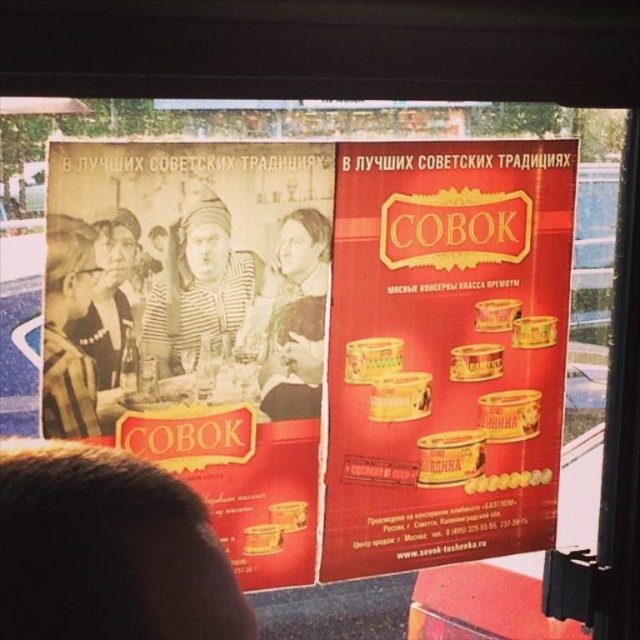
Question: Which point is farther to the camera?

Choices:
 (A) sepia paper poster at center
 (B) matte black headscarf at upper left

Answer: (B)

Question: Does matte black headscarf at upper left appear on the left side of matte black jacket at center?

Choices:
 (A) no
 (B) yes

Answer: (B)

Question: Considering the relative positions of matte black headscarf at upper left and matte black jacket at center in the image provided, where is matte black headscarf at upper left located with respect to matte black jacket at center?

Choices:
 (A) above
 (B) below

Answer: (A)

Question: Among these objects, which one is farthest from the camera?

Choices:
 (A) red matte can at center
 (B) sepia paper poster at center
 (C) matte black jacket at center
 (D) yellow matte can at lower right

Answer: (D)

Question: Estimate the real-world distances between objects in this image. Which object is closer to the matte black headscarf at upper left?

Choices:
 (A) red matte can at center
 (B) sepia paper poster at center

Answer: (B)

Question: Does matte black headscarf at upper left have a lesser width compared to yellow matte can at lower right?

Choices:
 (A) no
 (B) yes

Answer: (B)